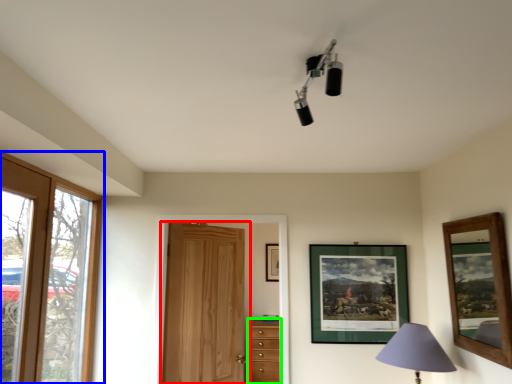
Question: Which is farther away from door (highlighted by a red box)? window (highlighted by a blue box) or chest of drawers (highlighted by a green box)?

Choices:
 (A) window
 (B) chest of drawers

Answer: (A)